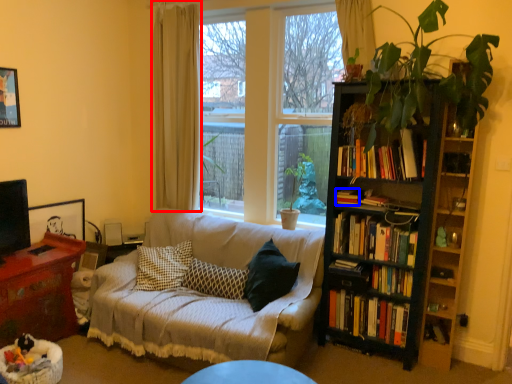
Question: Which point is closer to the camera, curtain (highlighted by a red box) or book (highlighted by a blue box)?

Choices:
 (A) curtain
 (B) book

Answer: (B)